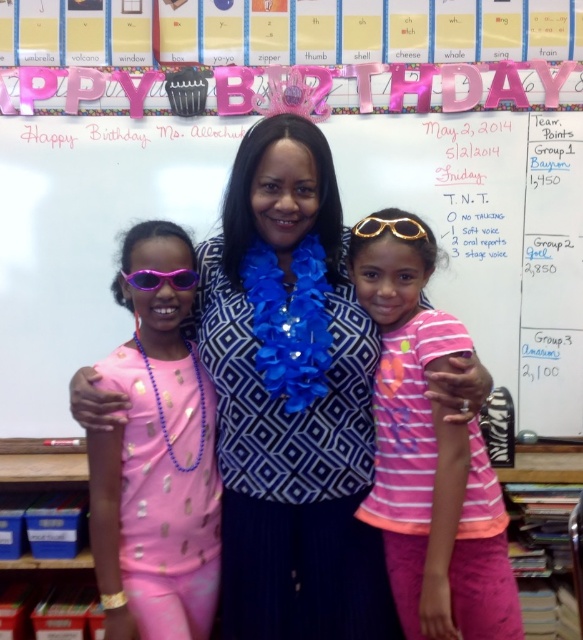
Question: Can you confirm if pink shiny sunglasses at left is positioned above purple shiny goggles at left?

Choices:
 (A) yes
 (B) no

Answer: (B)

Question: Which point appears closest to the camera in this image?

Choices:
 (A) (170, 262)
 (B) (360, 216)

Answer: (A)

Question: Can you confirm if pink shiny sunglasses at left is positioned to the right of gold metallic goggles at center?

Choices:
 (A) no
 (B) yes

Answer: (A)

Question: Based on their relative distances, which object is farther from the purple shiny goggles at left?

Choices:
 (A) blue sequined lei at center
 (B) pink paper banner at upper center
 (C) gold metallic goggles at center

Answer: (B)

Question: Is pink paper banner at upper center thinner than blue sequined lei at center?

Choices:
 (A) yes
 (B) no

Answer: (B)

Question: Which of the following is the closest to the observer?

Choices:
 (A) gold metallic goggles at center
 (B) blue sequined lei at center
 (C) pink paper banner at upper center
 (D) pink striped shirt at center

Answer: (B)